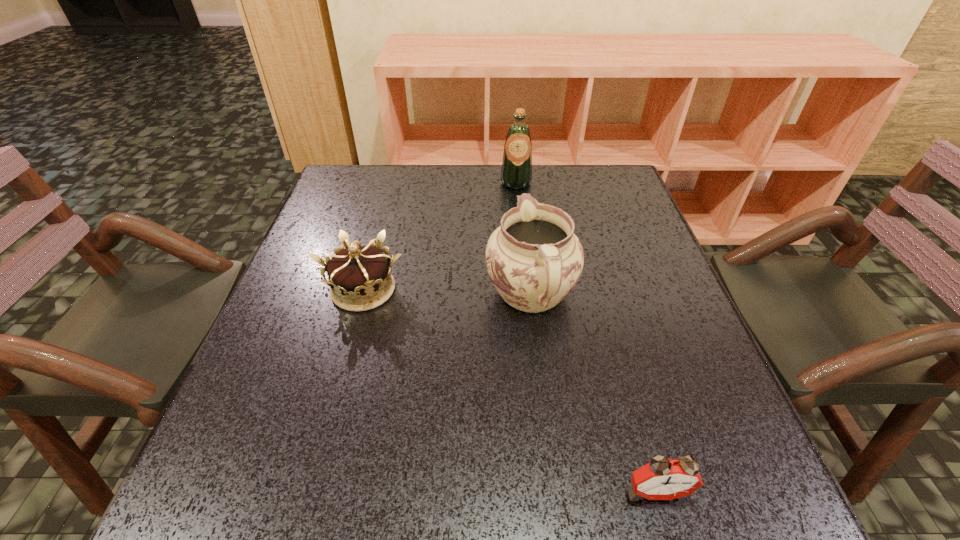
The height and width of the screenshot is (540, 960). Find the location of `object that is the third closest one to the pitcher`. object that is the third closest one to the pitcher is located at coordinates [x=516, y=173].